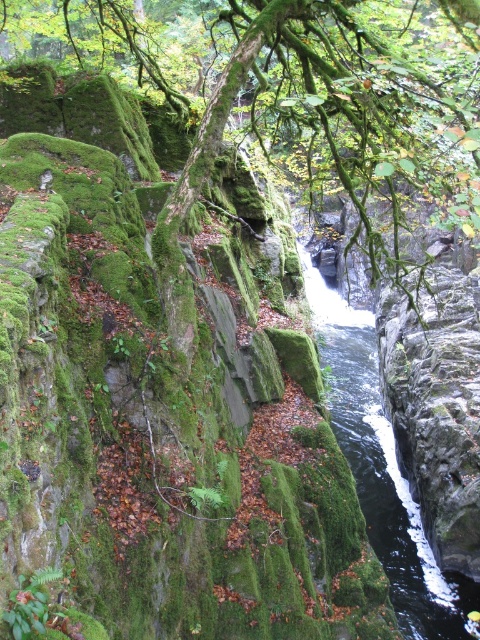
Can you confirm if green mossy branch at center is positioned below black glossy water at center?

No, green mossy branch at center is not below black glossy water at center.

Does point (359, 211) come behind point (320, 340)?

No, it is in front of (320, 340).

Is point (312, 131) more distant than point (363, 356)?

No.

You are a GUI agent. You are given a task and a screenshot of the screen. Output one action in this format:
    pyautogui.click(x=<x>, y=<y>)
    Task: Click on the green mossy branch at center
    Image resolution: width=480 pixels, height=640 pixels.
    Given the screenshot: What is the action you would take?
    pyautogui.click(x=357, y=92)